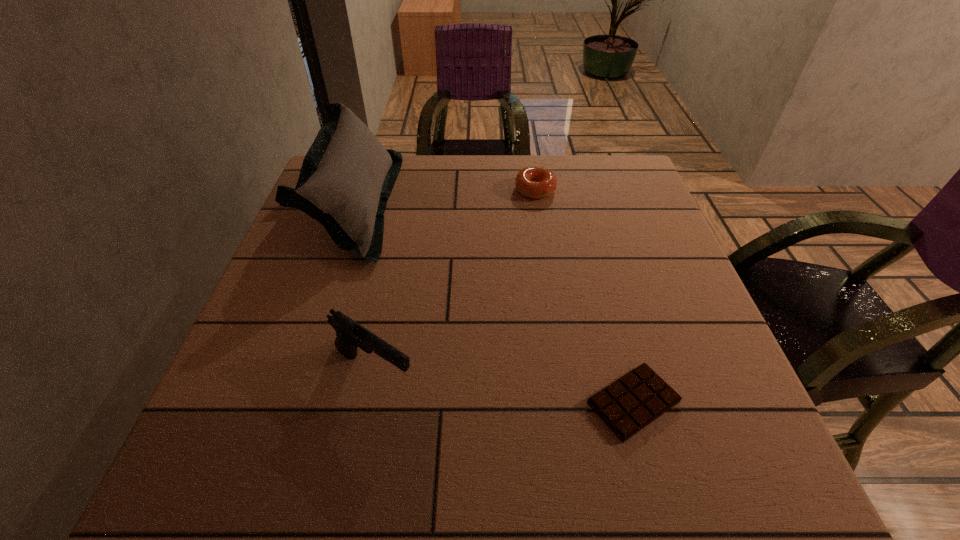
Image resolution: width=960 pixels, height=540 pixels. I want to click on blank region between the gun and the shortest object, so click(504, 387).

In order to click on vacant point located between the second shortest object and the second tallest object in this screenshot , I will do `click(455, 280)`.

Identify the location of vacant region between the third tallest object and the gun. (455, 280).

This screenshot has height=540, width=960. What are the coordinates of `free spot between the candy bar and the second tallest object` in the screenshot? It's located at (504, 387).

The width and height of the screenshot is (960, 540). I want to click on vacant area that lies between the tallest object and the candy bar, so click(495, 303).

This screenshot has height=540, width=960. Identify the location of free spot between the doughnut and the shortest object. (585, 296).

Identify the location of vacant space that's between the third tallest object and the tallest object. (446, 197).

You are a GUI agent. You are given a task and a screenshot of the screen. Output one action in this format:
    pyautogui.click(x=<x>, y=<y>)
    Task: Click on the free space between the gun and the candy bar
    This screenshot has height=540, width=960.
    Given the screenshot: What is the action you would take?
    pyautogui.click(x=504, y=387)

Identify the location of free spot between the doughnut and the candy bar. (585, 296).

I want to click on vacant space that is in between the gun and the shortest object, so click(x=504, y=387).